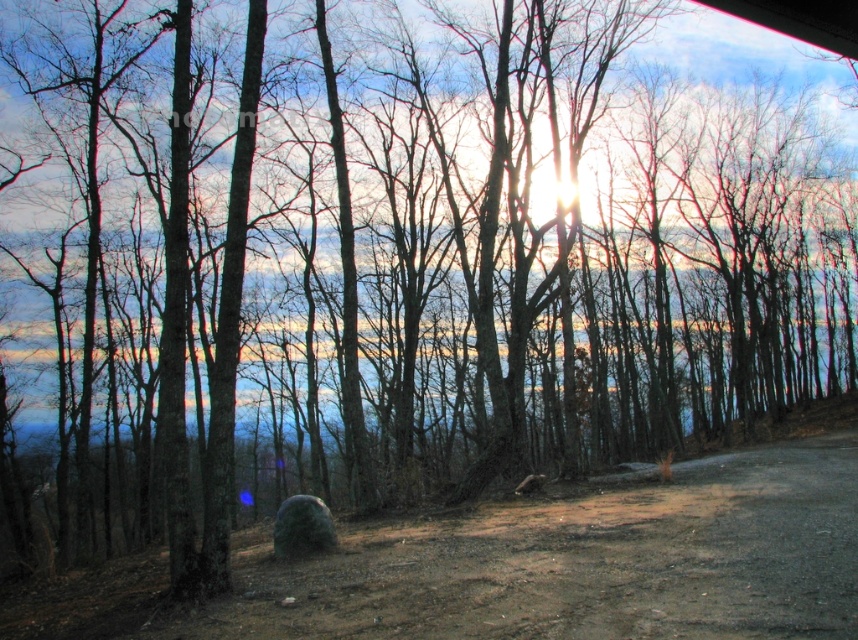
In the scene shown: Which of these two, dull brown dirt track at lower right or green mossy boulder at center, stands shorter?

green mossy boulder at center

Does point (681, 614) lie in front of point (325, 525)?

Yes, point (681, 614) is closer to viewer.

Which is behind, point (846, 522) or point (318, 497)?

The point (318, 497) is more distant.

You are a GUI agent. You are given a task and a screenshot of the screen. Output one action in this format:
    pyautogui.click(x=<x>, y=<y>)
    Task: Click on the dull brown dirt track at lower right
    
    Given the screenshot: What is the action you would take?
    pyautogui.click(x=529, y=566)